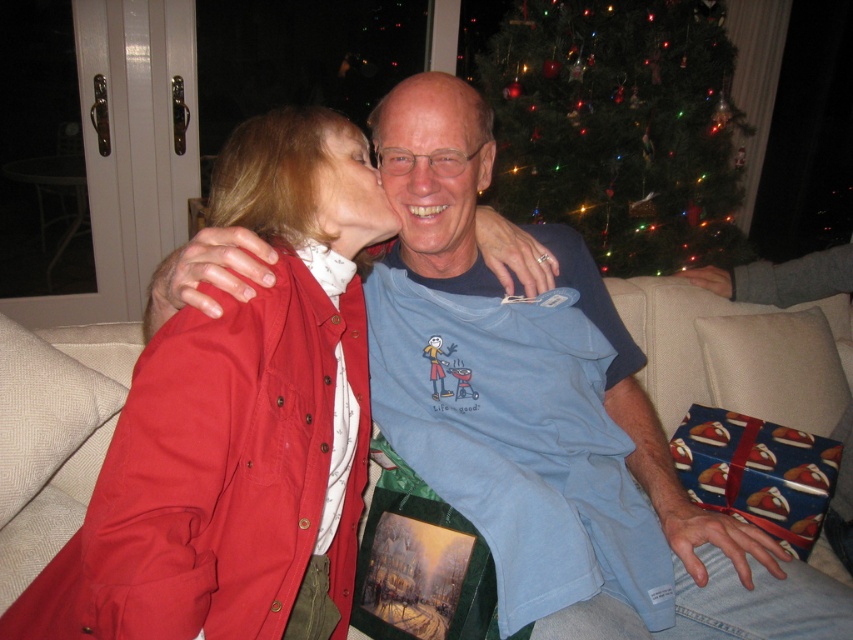
You are a photographer adjusting your camera to focus on the blue cotton t shirt at center. The camera has a focal point at coordinates point (558,460). Will the blue cotton t shirt at center be in focus?

Yes, the blue cotton t shirt at center is exactly at point (558,460), so it will be in focus.